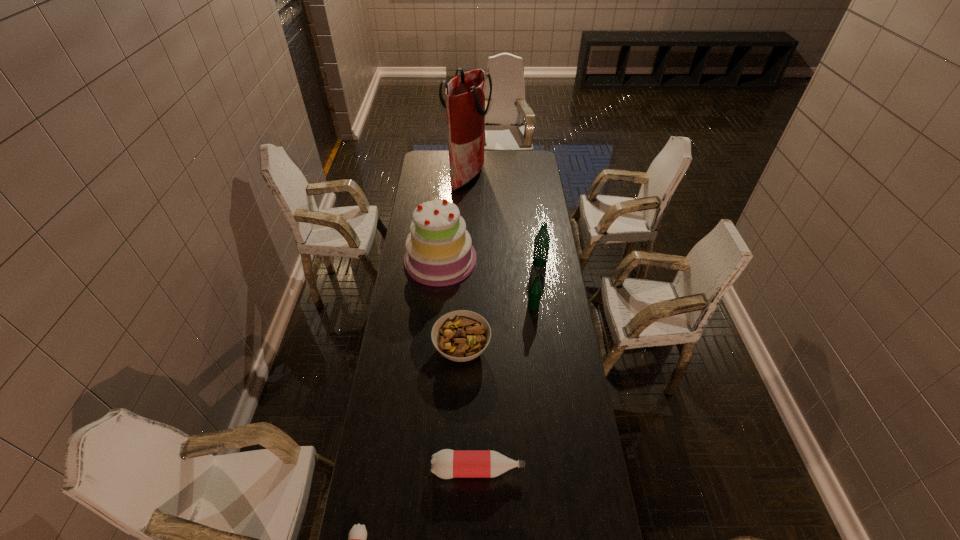
Where is `the sixth tallest object`? The image size is (960, 540). the sixth tallest object is located at coordinates (446, 464).

Where is `the farther pink bottle`? The image size is (960, 540). the farther pink bottle is located at coordinates (446, 464).

Identify the location of vacant space located 0.270m on the right of the tallest object. (536, 175).

Find the location of a particular element. This screenshot has height=540, width=960. vacant space located 0.340m on the front of the cake is located at coordinates (433, 349).

You are a GUI agent. You are given a task and a screenshot of the screen. Output one action in this format:
    pyautogui.click(x=<x>, y=<y>)
    Task: Click on the free space located on the front of the farther green bottle
    This screenshot has height=540, width=960.
    Given the screenshot: What is the action you would take?
    pyautogui.click(x=547, y=316)

This screenshot has width=960, height=540. I want to click on free space located on the front of the third nearest bottle, so click(x=541, y=376).

The width and height of the screenshot is (960, 540). Find the location of `vacant space located 0.140m on the right of the fifth farthest object`. vacant space located 0.140m on the right of the fifth farthest object is located at coordinates (526, 348).

The width and height of the screenshot is (960, 540). Identify the location of blank space located 0.060m with the cap open on the third bottle from right to left. (542, 469).

Image resolution: width=960 pixels, height=540 pixels. Identify the location of object that is at the far edge. (465, 94).

Locate an element on the screen. Image resolution: width=960 pixels, height=540 pixels. object that is at the left edge is located at coordinates (439, 252).